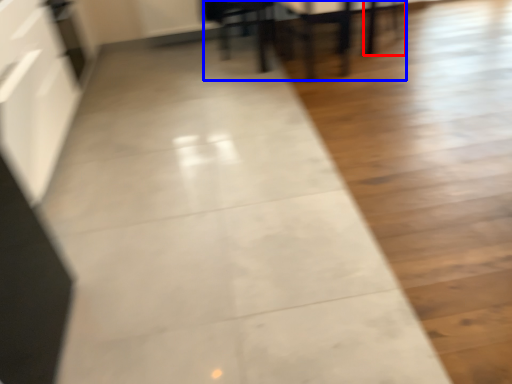
Question: Which of the following is the farthest to the observer, chair (highlighted by a red box) or table (highlighted by a blue box)?

Choices:
 (A) chair
 (B) table

Answer: (A)